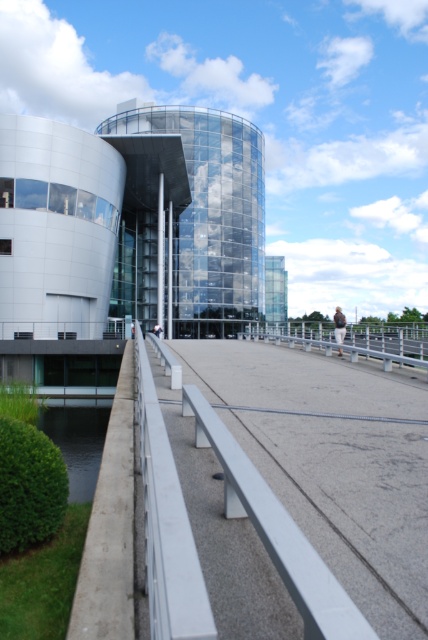
You are standing in front of the modern architectural structure and want to reach the point marked at coordinates point (353,422). Given that the walkway is 5 meters long, can you walk straight ahead to reach it?

The point point (353,422) is 7.49 meters away from the camera, but the walkway is only 5 meters long. Therefore, you cannot reach the point by walking straight ahead as the distance exceeds the walkway length.

You are a maintenance worker needing to place a 1.2 meter tall equipment on the smooth concrete path at center. Can the equipment be placed there without exceeding the height of the silver metallic rail at center?

The smooth concrete path at center is not as tall as the silver metallic rail at center. Since the equipment is 1.2 meters tall, it can be placed there as long as its height does not exceed the rail. However, since the path itself is shorter in height than the rail, the equipment can be placed there without exceeding the rail height.

You are a delivery robot that is 1.2 meters wide. You need to navigate along the smooth concrete path at center while staying as close as possible to the silver metallic rail at center. Is there enough space for you to move without crossing into the area beyond the rail?

The distance between the smooth concrete path at center and the silver metallic rail at center is 5.41 meters. Since the robot is only 1.2 meters wide, there is ample space for it to move along the path while staying close to the rail without crossing over.